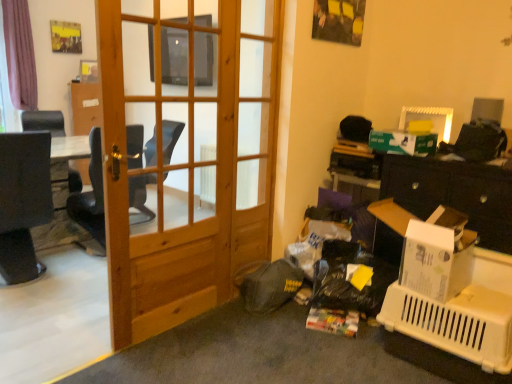
Question: From a real-world perspective, relative to white cardboard box at right, is black leather chair at left vertically above or below?

Choices:
 (A) below
 (B) above

Answer: (A)

Question: From the image's perspective, is black leather chair at left positioned above or below white cardboard box at right?

Choices:
 (A) above
 (B) below

Answer: (A)

Question: Which object is positioned closest to the white plastic picture frame at upper right?

Choices:
 (A) green cardboard box at upper right
 (B) natural wood door at center
 (C) black leather chair at left
 (D) white cardboard box at right
 (E) matte black speaker at upper right

Answer: (E)

Question: Which of these objects is positioned closest to the white plastic picture frame at upper right?

Choices:
 (A) natural wood door at center
 (B) black leather chair at left
 (C) green cardboard box at upper right
 (D) white cardboard box at right
 (E) matte black speaker at upper right

Answer: (E)